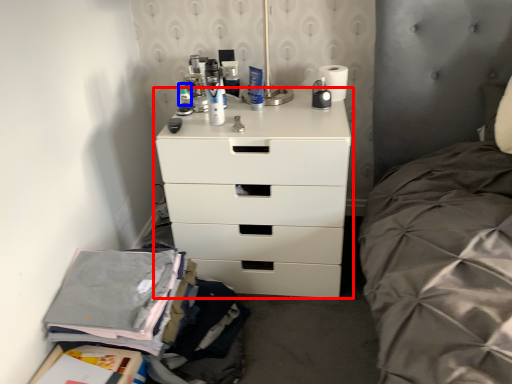
Question: Among these objects, which one is nearest to the camera, chest of drawers (highlighted by a red box) or toiletry (highlighted by a blue box)?

Choices:
 (A) chest of drawers
 (B) toiletry

Answer: (A)